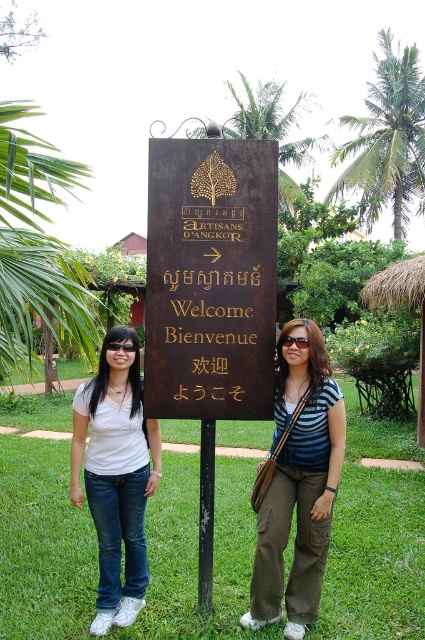
Question: Is brown polished wood sign at center bigger than white matte t-shirt at left?

Choices:
 (A) no
 (B) yes

Answer: (B)

Question: Which of these objects is positioned farthest from the striped fabric shirt at center?

Choices:
 (A) brown polished wood sign at center
 (B) white matte t-shirt at left

Answer: (B)

Question: Which point is farther to the camera?

Choices:
 (A) (274, 444)
 (B) (246, 314)

Answer: (A)

Question: Is brown polished wood sign at center further to camera compared to white matte t-shirt at left?

Choices:
 (A) no
 (B) yes

Answer: (A)

Question: Can you confirm if striped fabric shirt at center is positioned above white matte t-shirt at left?

Choices:
 (A) yes
 (B) no

Answer: (A)

Question: Which of the following is the farthest from the observer?

Choices:
 (A) brown polished wood sign at center
 (B) white matte t-shirt at left

Answer: (B)